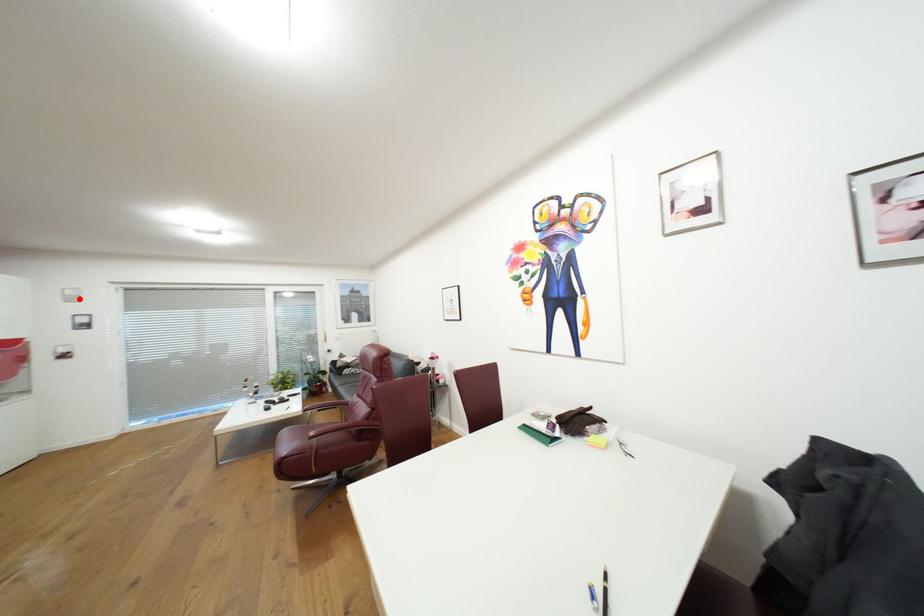
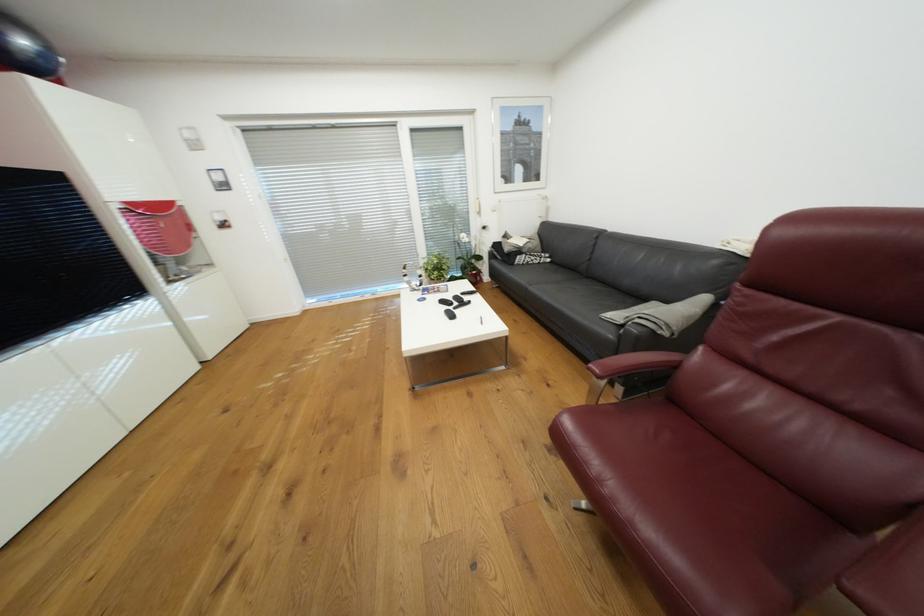
Find the pixel in the second image that matches the highlighted location in the first image.

(201, 145)